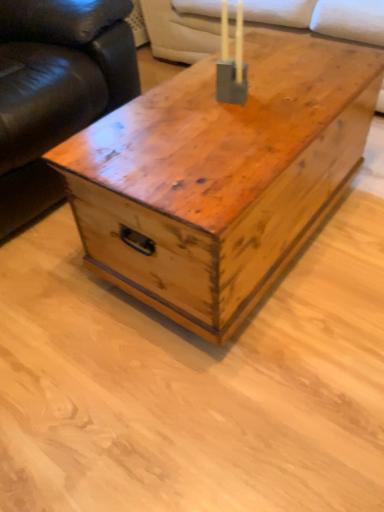
Identify the location of vacant area on the back side of matte gray concrete candle holder at center. This screenshot has width=384, height=512. (245, 73).